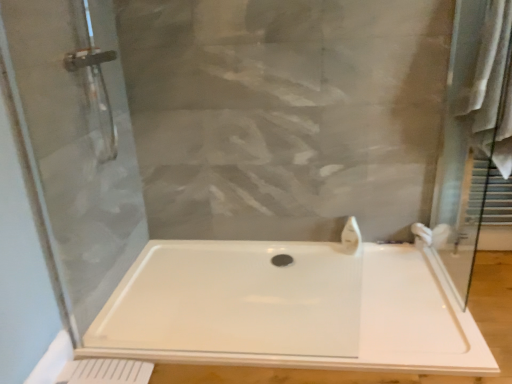
Question: Is the position of white plastic bathtub at center less distant than that of white glossy faucet at upper right?

Choices:
 (A) yes
 (B) no

Answer: (A)

Question: Is white plastic bathtub at center located outside white glossy faucet at upper right?

Choices:
 (A) yes
 (B) no

Answer: (A)

Question: Is white plastic bathtub at center oriented away from white glossy faucet at upper right?

Choices:
 (A) yes
 (B) no

Answer: (B)

Question: Can you confirm if white plastic bathtub at center is wider than white glossy faucet at upper right?

Choices:
 (A) no
 (B) yes

Answer: (B)

Question: Is the depth of white plastic bathtub at center greater than that of white glossy faucet at upper right?

Choices:
 (A) no
 (B) yes

Answer: (A)

Question: From the image's perspective, is white plastic bathtub at center under white glossy faucet at upper right?

Choices:
 (A) yes
 (B) no

Answer: (A)

Question: Is white plastic bathtub at center wider than white fabric bath towel at right?

Choices:
 (A) no
 (B) yes

Answer: (B)

Question: Is the position of white plastic bathtub at center more distant than that of white fabric bath towel at right?

Choices:
 (A) no
 (B) yes

Answer: (A)

Question: From a real-world perspective, is white plastic bathtub at center below white fabric bath towel at right?

Choices:
 (A) yes
 (B) no

Answer: (A)

Question: Is white plastic bathtub at center to the left of white fabric bath towel at right from the viewer's perspective?

Choices:
 (A) yes
 (B) no

Answer: (A)

Question: Is white fabric bath towel at right located within white plastic bathtub at center?

Choices:
 (A) yes
 (B) no

Answer: (B)

Question: Would you say white plastic bathtub at center is outside white fabric bath towel at right?

Choices:
 (A) yes
 (B) no

Answer: (A)

Question: Does white glossy faucet at upper right have a lesser width compared to white fabric bath towel at right?

Choices:
 (A) yes
 (B) no

Answer: (A)